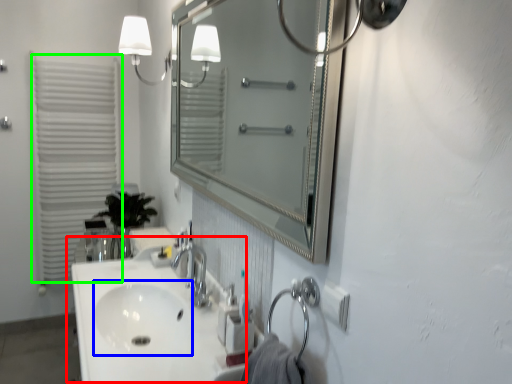
Question: Estimate the real-world distances between objects in this image. Which object is farther from sink (highlighted by a red box), sink (highlighted by a blue box) or shutter (highlighted by a green box)?

Choices:
 (A) sink
 (B) shutter

Answer: (B)